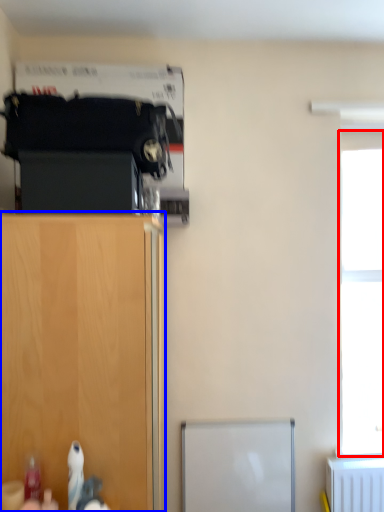
Question: Which point is closer to the camera, window (highlighted by a red box) or cupboard (highlighted by a blue box)?

Choices:
 (A) window
 (B) cupboard

Answer: (B)